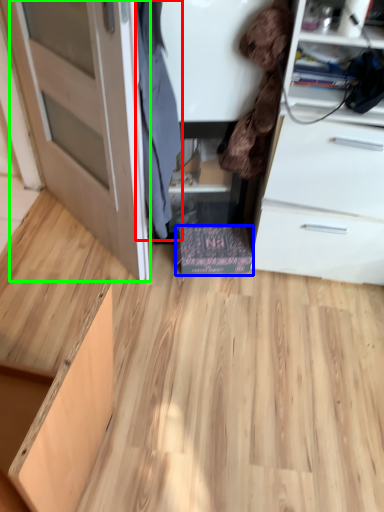
Question: Which object is positioned closest to clothing (highlighted by a red box)? Select from cabinetry (highlighted by a blue box) and door (highlighted by a green box).

Choices:
 (A) cabinetry
 (B) door

Answer: (B)